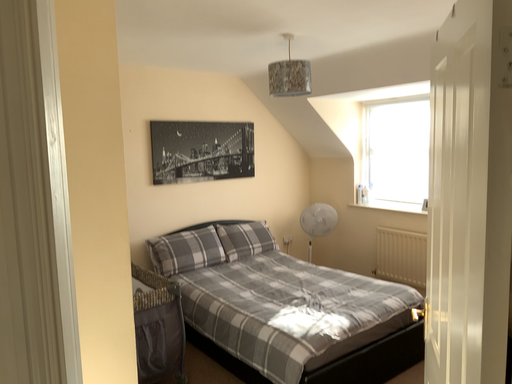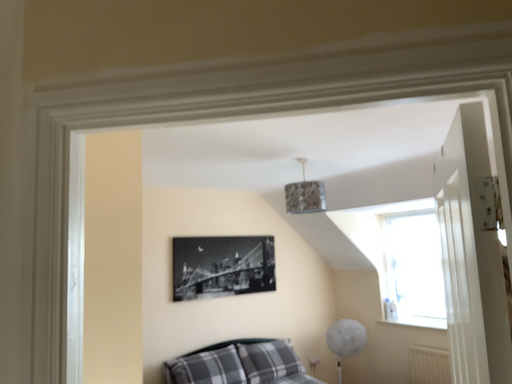
Question: How did the camera likely rotate when shooting the video?

Choices:
 (A) rotated upward
 (B) rotated downward

Answer: (A)